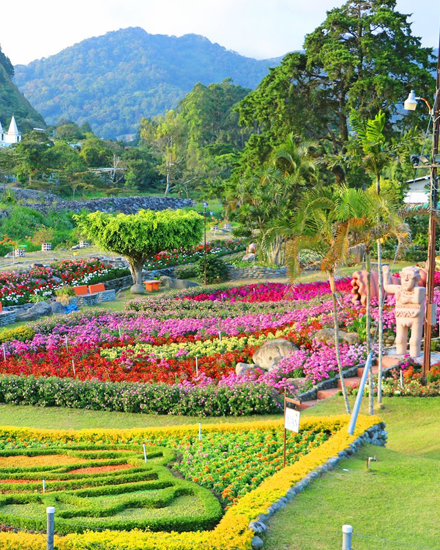
Identify the location of statue. This screenshot has width=440, height=550. (405, 300).